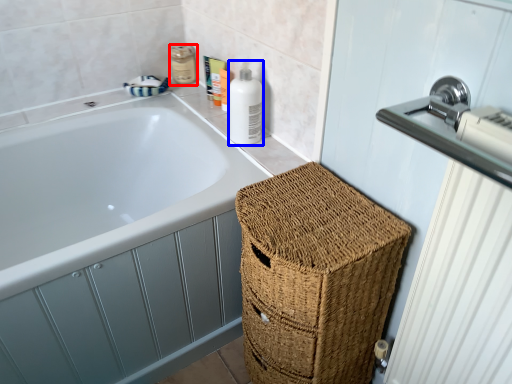
Question: Among these objects, which one is farthest to the camera, toiletry (highlighted by a red box) or cleaning product (highlighted by a blue box)?

Choices:
 (A) toiletry
 (B) cleaning product

Answer: (A)